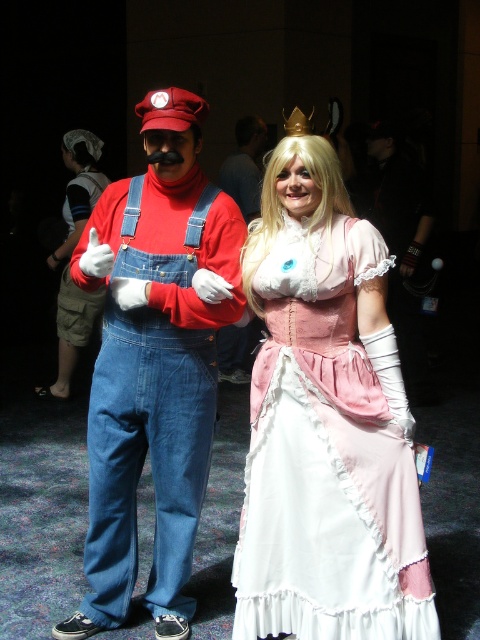
Is pink satin dress at center wider than matte denim overalls at left?

Incorrect, pink satin dress at center's width does not surpass matte denim overalls at left's.

Can you confirm if pink satin dress at center is positioned above matte denim overalls at left?

No.

Who is more distant from viewer, (324,426) or (206,193)?

The point (206,193) is more distant.

Where is `pink satin dress at center`? pink satin dress at center is located at coordinates (328, 456).